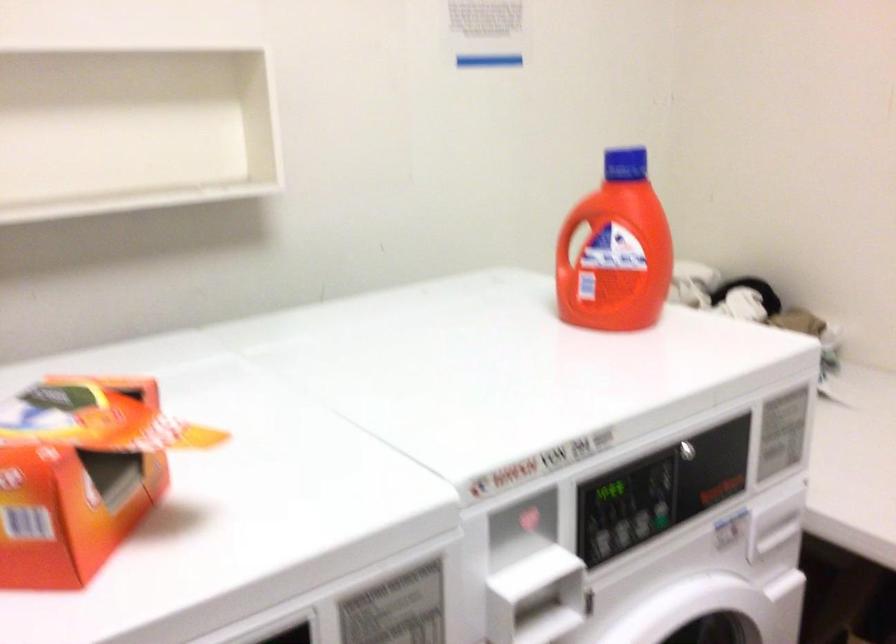
This screenshot has height=644, width=896. Identify the location of detergent bottle handle. (567, 239).